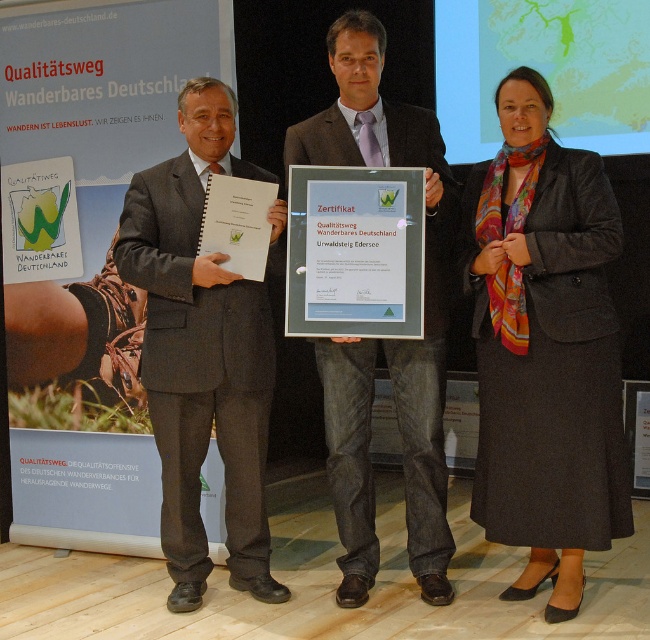
You are a photographer at the event and need to adjust the lighting so that the dark gray wool skirt at lower right and the matte black suit at center are both well lit. Since the skirt is closer to you, which object should you focus on first to ensure proper exposure?

The dark gray wool skirt at lower right is closer to the viewer than the matte black suit at center, so you should focus on the dark gray wool skirt at lower right first to ensure proper exposure.

You are a photographer at the event and want to take a closeup of the green glass certificate at center without the matte black suit at center blocking it. How can you adjust your camera position to achieve this?

Move your camera position closer to the green glass certificate at center so that the matte black suit at center is no longer in front of it. Since the matte black suit at center is further to the viewer than the green glass certificate at center, moving closer to the certificate will allow you to frame it without obstruction.